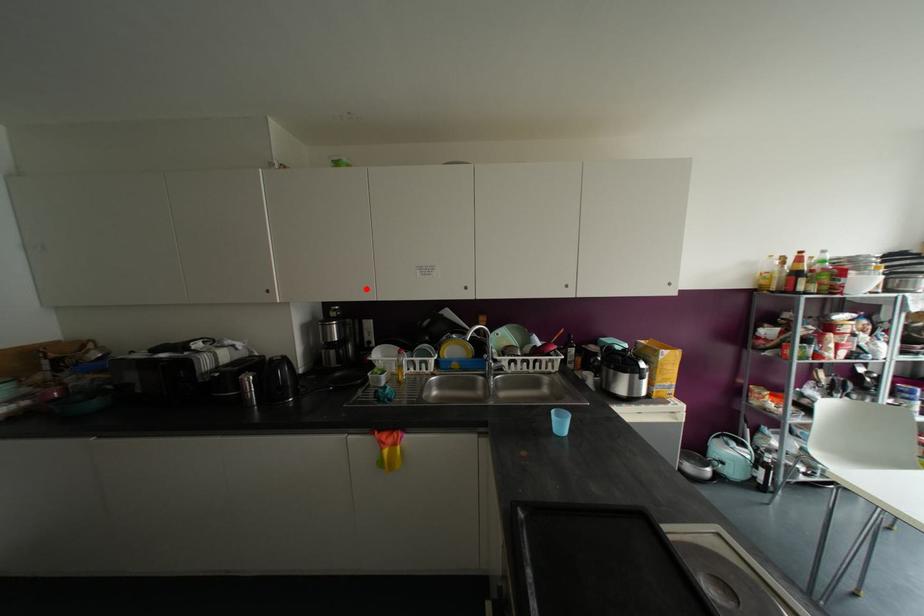
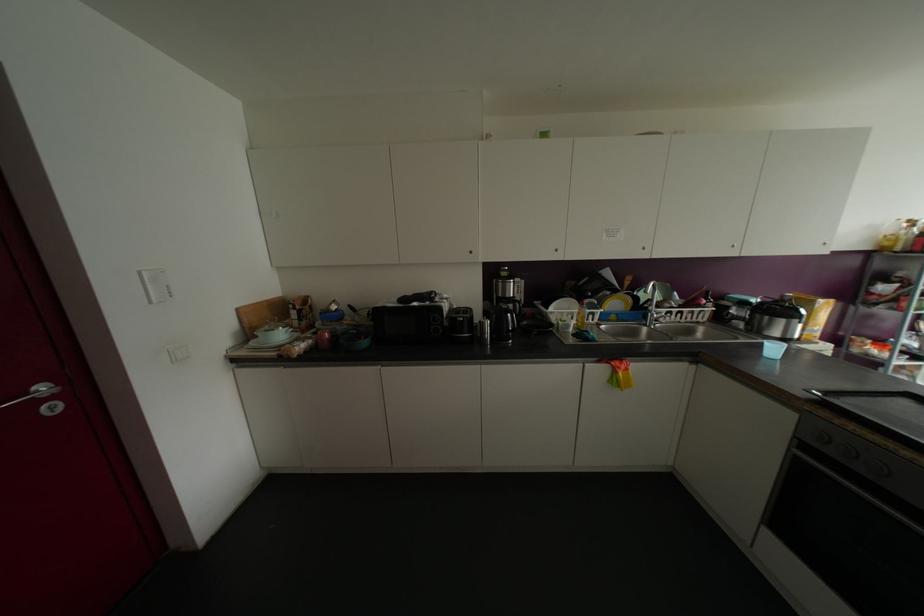
Find the pixel in the second image that matches the highlighted location in the first image.

(555, 249)